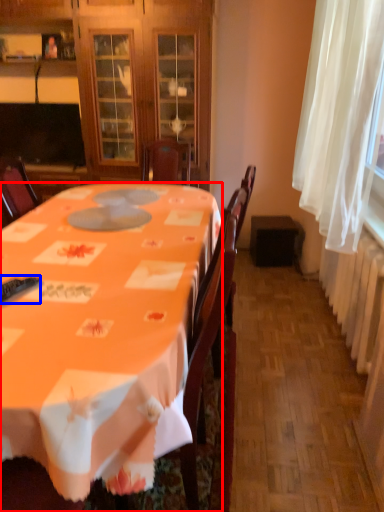
Question: Which point is closer to the camera, desk (highlighted by a red box) or remote control (highlighted by a blue box)?

Choices:
 (A) desk
 (B) remote control

Answer: (A)